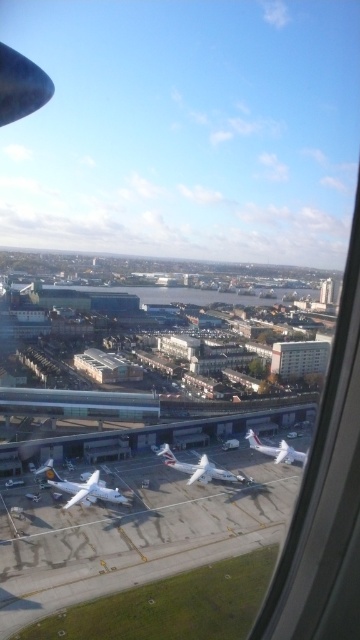
Question: Is white matte tarmac at center closer to camera compared to white matte airplane at center?

Choices:
 (A) yes
 (B) no

Answer: (A)

Question: Which of these objects is positioned closest to the white matte airplane at lower left?

Choices:
 (A) white matte airplane at center
 (B) white glossy airplane at center
 (C) white matte tarmac at center

Answer: (C)

Question: Is white matte airplane at lower left smaller than white matte airplane at center?

Choices:
 (A) yes
 (B) no

Answer: (B)

Question: Where is white glossy airplane at center located in relation to white matte airplane at center in the image?

Choices:
 (A) left
 (B) right

Answer: (A)

Question: Which of these objects is positioned farthest from the white matte airplane at center?

Choices:
 (A) white glossy airplane at center
 (B) white matte tarmac at center

Answer: (B)

Question: Which point is closer to the camera?

Choices:
 (A) (90, 486)
 (B) (298, 456)
 (C) (237, 481)

Answer: (A)